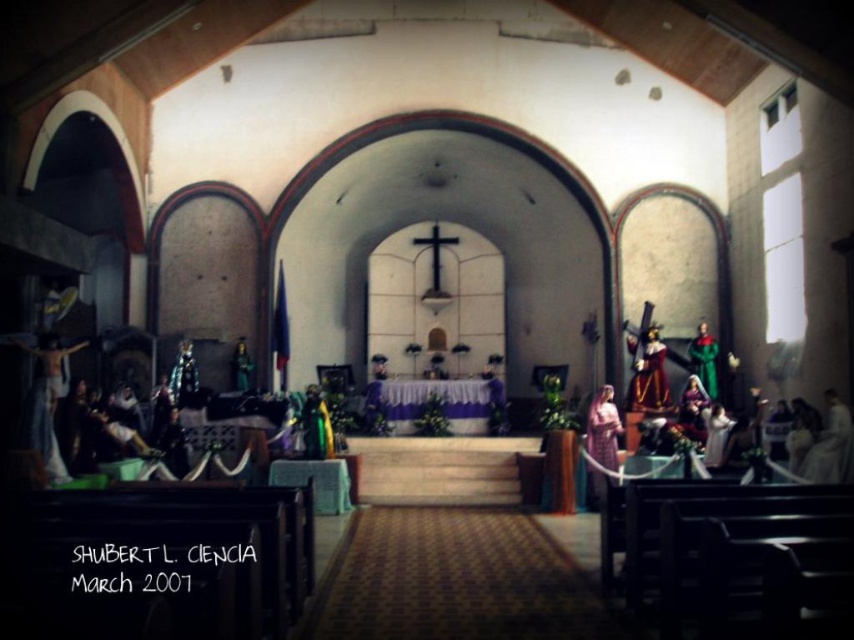
You are an interior designer assessing the church layout. You notice the matte wooden crucifix at left and the matte pink fabric at center. Which object is taller in height?

The matte wooden crucifix at left is taller than the matte pink fabric at center.

You are standing at the entrance of the church and want to locate the matte wooden crucifix at left. According to the coordinates provided, in which direction should you look to find it?

The matte wooden crucifix at left is located at coordinates point (47,401). Since the x coordinate is 0.627, which is greater than 0.5, you should look to your right to find it.